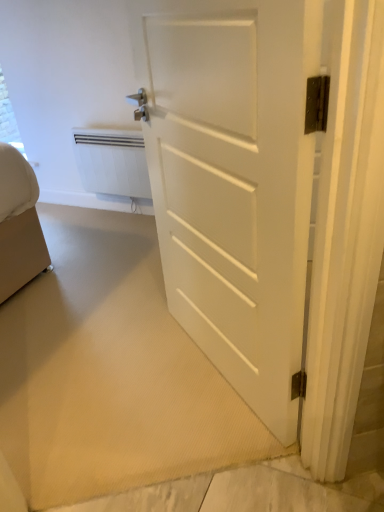
At what (x,y) coordinates should I click in order to perform the action: click on vacant region to the left of white matte door at center. Please return your answer as a coordinate pair (x, y). Looking at the image, I should click on (112, 404).